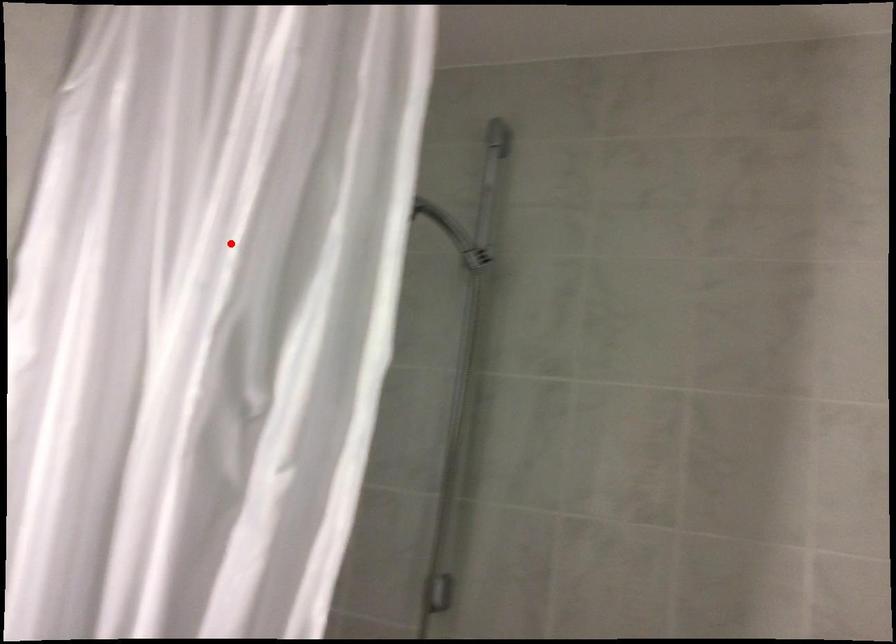
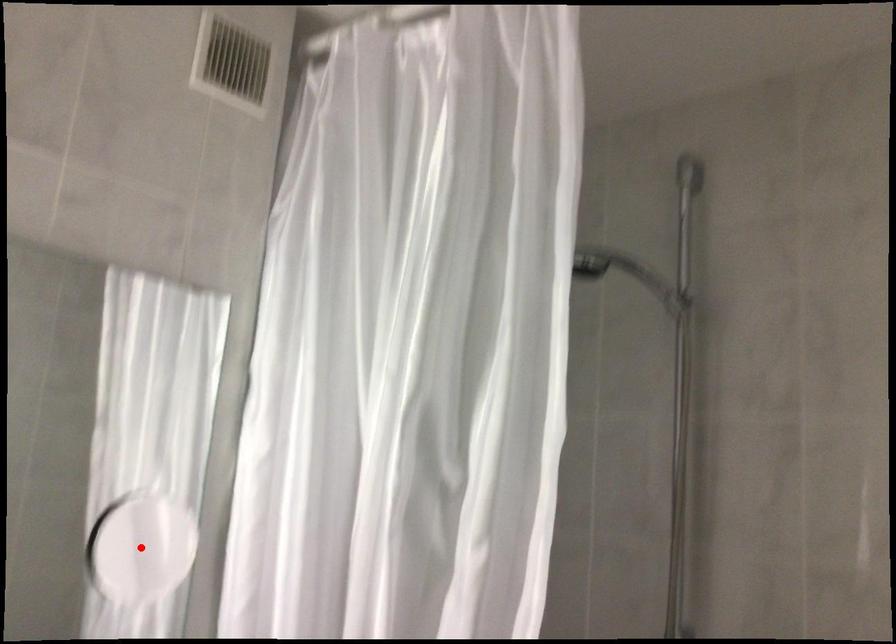
I am providing you with two images of the same scene from different viewpoints. A red point is marked on the first image and another point is marked on the second image. Is the marked point in image1 the same physical position as the marked point in image2?

No